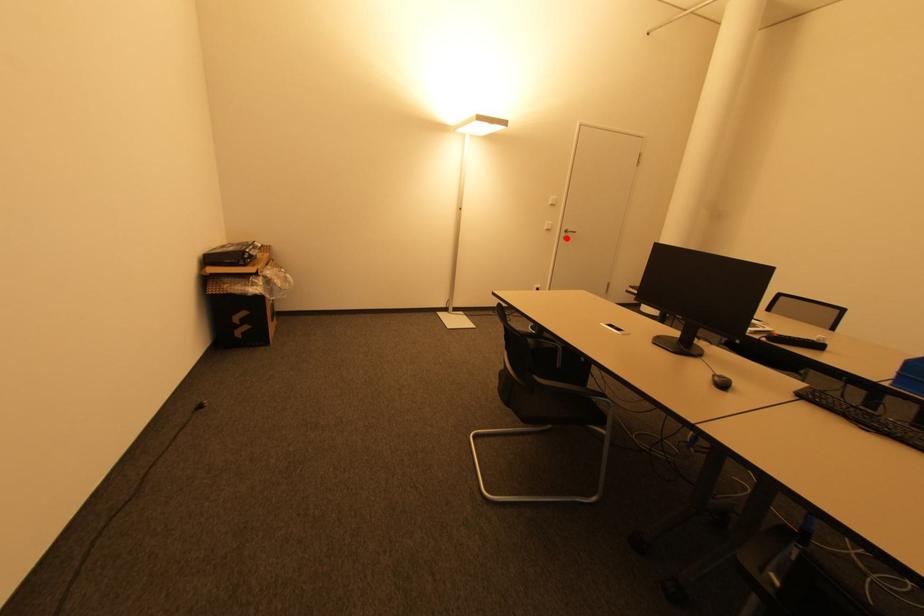
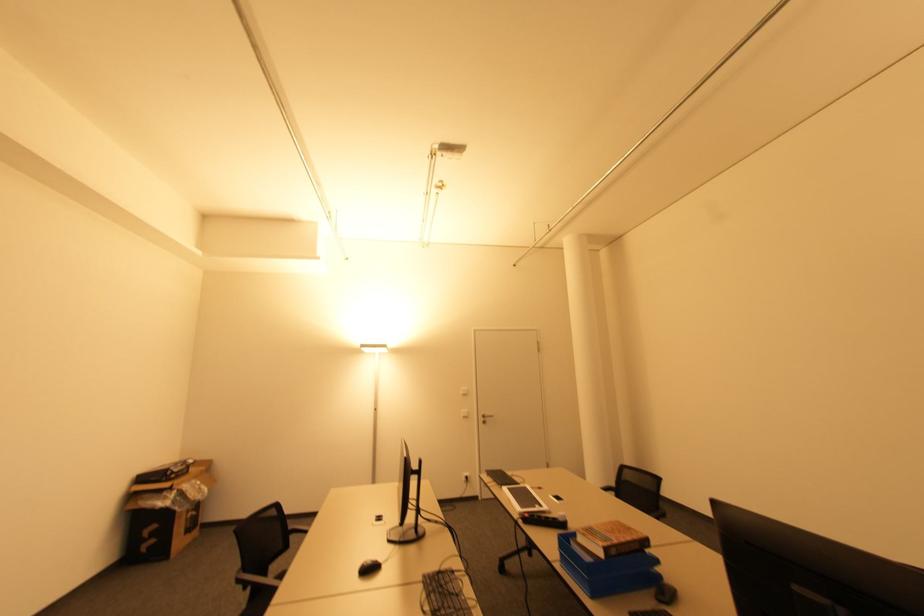
Question: A red point is marked in image1. In image2, is the corresponding 3D point closer to the camera or farther? Reply with the corresponding letter.

Choices:
 (A) The corresponding 3D point is closer.
 (B) The corresponding 3D point is farther.

Answer: (B)